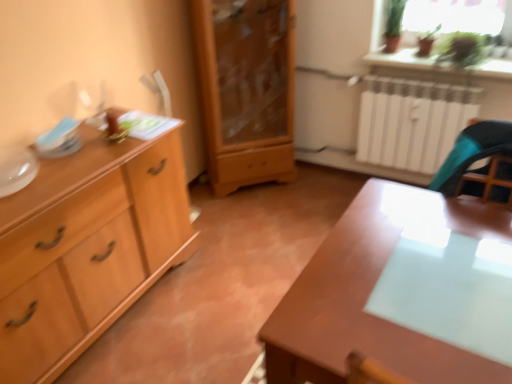
Question: From their relative heights in the image, would you say light wood cabinet at center, arranged as the 1th chest of drawers when viewed from the right, is taller or shorter than light wood cabinet at left, the 1th chest of drawers positioned from the left?

Choices:
 (A) tall
 (B) short

Answer: (A)

Question: In the image, is light wood cabinet at center, the 2th chest of drawers in the left-to-right sequence, positioned in front of or behind light wood cabinet at left, the 1th chest of drawers positioned from the left?

Choices:
 (A) behind
 (B) front

Answer: (A)

Question: Estimate the real-world distances between objects in this image. Which object is farther from the green leafy plant at upper right?

Choices:
 (A) light wood cabinet at left, the 1th chest of drawers positioned from the left
 (B) glossy wood table at center
 (C) transparent glass table at right
 (D) light wood cabinet at center, the 2th chest of drawers in the left-to-right sequence

Answer: (A)

Question: Which of these objects is positioned closest to the glossy wood table at center?

Choices:
 (A) light wood cabinet at left, positioned as the 2th chest of drawers in right-to-left order
 (B) transparent glass table at right
 (C) light wood cabinet at center, arranged as the 1th chest of drawers when viewed from the right
 (D) green leafy plant at upper right

Answer: (B)